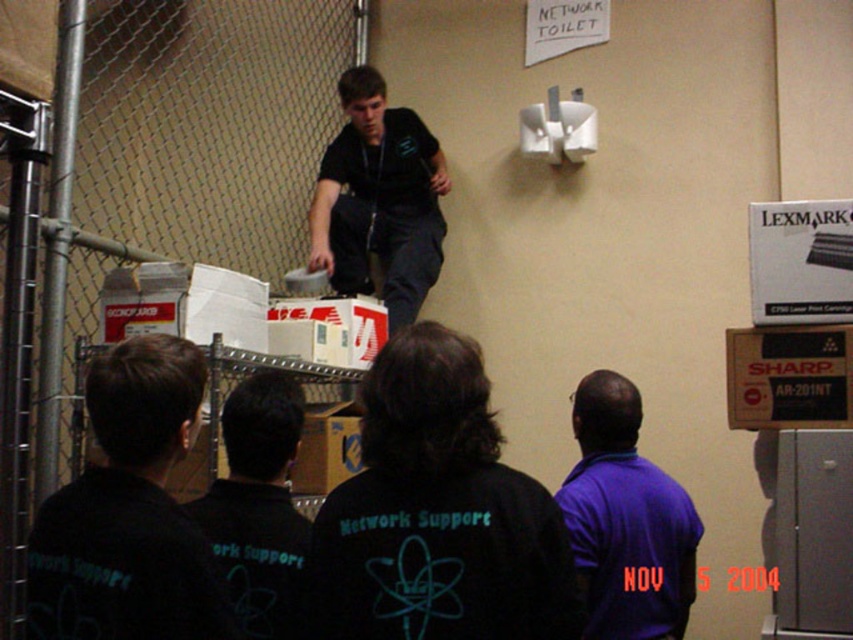
Is metal chain-link fence at left positioned in front of dark blue shirt at upper center?

No, it is behind dark blue shirt at upper center.

Where is `metal chain-link fence at left`? This screenshot has height=640, width=853. metal chain-link fence at left is located at coordinates (151, 188).

This screenshot has height=640, width=853. In order to click on metal chain-link fence at left in this screenshot , I will do `click(151, 188)`.

Can you confirm if black matte shirt at lower left is bigger than purple matte shirt at center?

No, black matte shirt at lower left is not bigger than purple matte shirt at center.

Can you confirm if black matte shirt at lower left is wider than purple matte shirt at center?

Incorrect, black matte shirt at lower left's width does not surpass purple matte shirt at center's.

Is point (154, 557) positioned behind point (683, 580)?

No, it is in front of (683, 580).

This screenshot has width=853, height=640. I want to click on black matte shirt at lower left, so click(128, 513).

Between purple matte shirt at center and dark blue shirt at upper center, which one is positioned lower?

purple matte shirt at center

Is point (624, 568) behind point (408, 157)?

No, it is not.

Between point (634, 390) and point (343, 264), which one is positioned behind?

The point (343, 264) is behind.

You are a GUI agent. You are given a task and a screenshot of the screen. Output one action in this format:
    pyautogui.click(x=<x>, y=<y>)
    Task: Click on the purple matte shirt at center
    
    Given the screenshot: What is the action you would take?
    pyautogui.click(x=625, y=520)